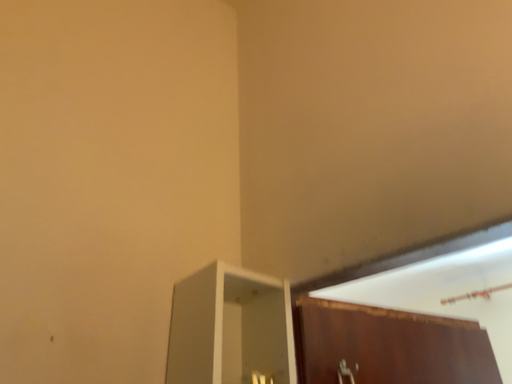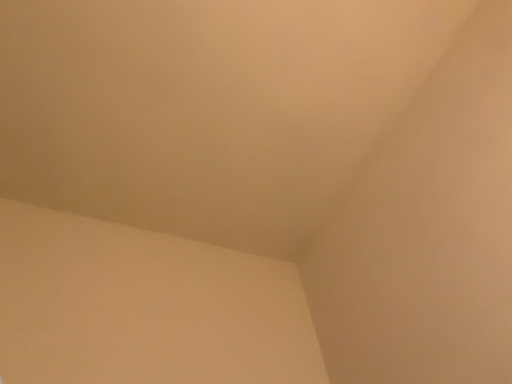
Question: How did the camera likely rotate when shooting the video?

Choices:
 (A) rotated right
 (B) rotated left

Answer: (B)